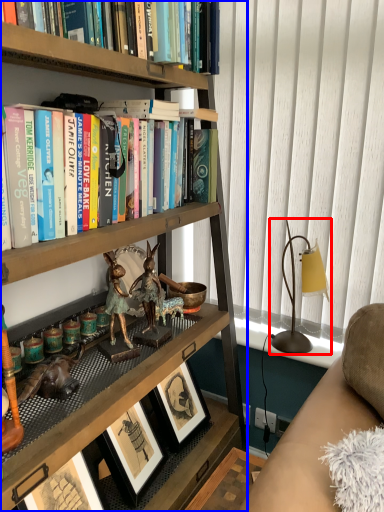
Question: Which of the following is the closest to the observer, table lamp (highlighted by a red box) or bookcase (highlighted by a blue box)?

Choices:
 (A) table lamp
 (B) bookcase

Answer: (B)